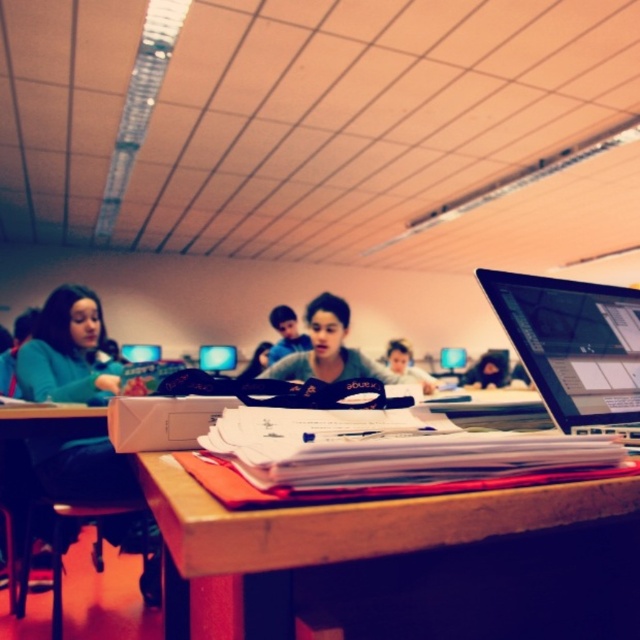
Question: Is matte black glasses at center below matte black laptop at center?

Choices:
 (A) yes
 (B) no

Answer: (B)

Question: Does wooden desk at center lie in front of matte black laptop at center?

Choices:
 (A) yes
 (B) no

Answer: (A)

Question: Which point is farther to the camera?

Choices:
 (A) matte gray shirt at center
 (B) matte black monitor at upper center
 (C) matte black glasses at center

Answer: (B)

Question: Is wooden desk at center smaller than matte black glasses at center?

Choices:
 (A) yes
 (B) no

Answer: (A)

Question: Which object is the farthest from the matte gray shirt at center?

Choices:
 (A) wooden desk at center
 (B) sleek silver laptop at center

Answer: (A)

Question: Among these objects, which one is farthest from the camera?

Choices:
 (A) matte black monitor at center
 (B) matte gray shirt at center

Answer: (A)